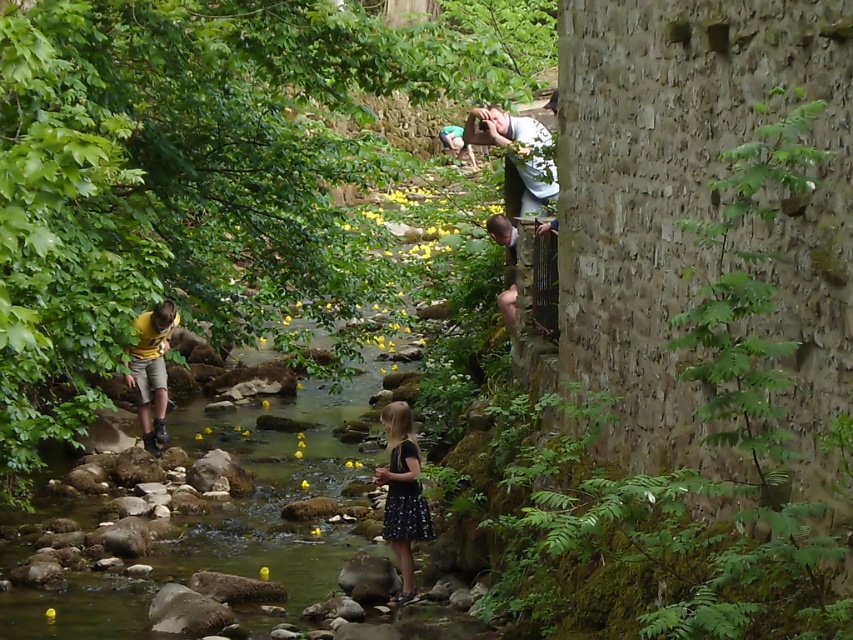
Is white cotton shirt at upper center behind yellow matte shorts at center?

No, it is in front of yellow matte shorts at center.

Is point (508, 116) farther from viewer compared to point (143, 317)?

No, it is not.

Where is `white cotton shirt at upper center`? white cotton shirt at upper center is located at coordinates (517, 150).

Which is behind, point (390, 467) or point (534, 129)?

The point (534, 129) is more distant.

Based on the photo, who is positioned more to the right, black dotted skirt at center or white cotton shirt at upper center?

white cotton shirt at upper center

Where is `black dotted skirt at center`? black dotted skirt at center is located at coordinates (402, 493).

Where is `black dotted skirt at center`? black dotted skirt at center is located at coordinates (402, 493).

Can you confirm if black dotted skirt at center is positioned above yellow matte shorts at center?

No, black dotted skirt at center is not above yellow matte shorts at center.

Does black dotted skirt at center come in front of yellow matte shorts at center?

Yes, it is in front of yellow matte shorts at center.

The width and height of the screenshot is (853, 640). I want to click on black dotted skirt at center, so click(x=402, y=493).